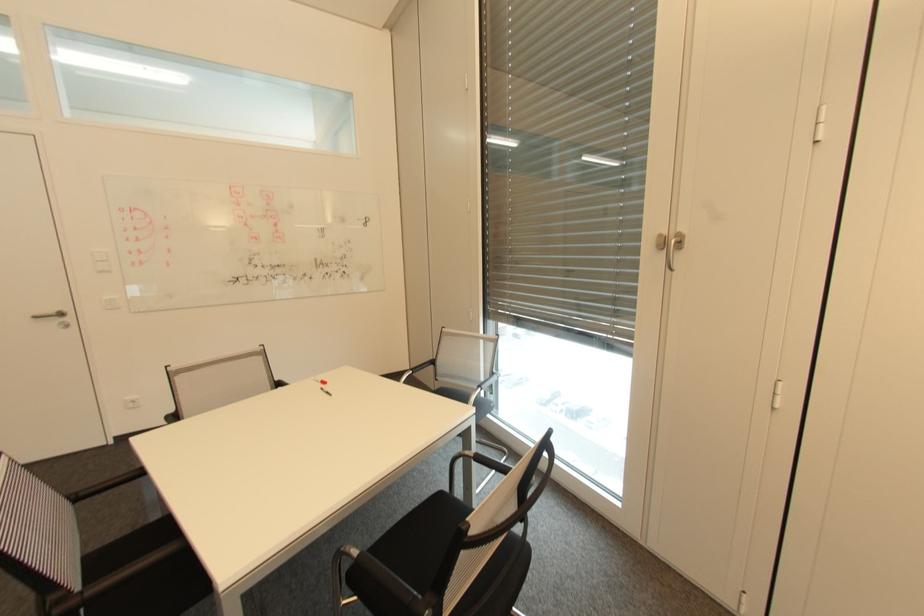
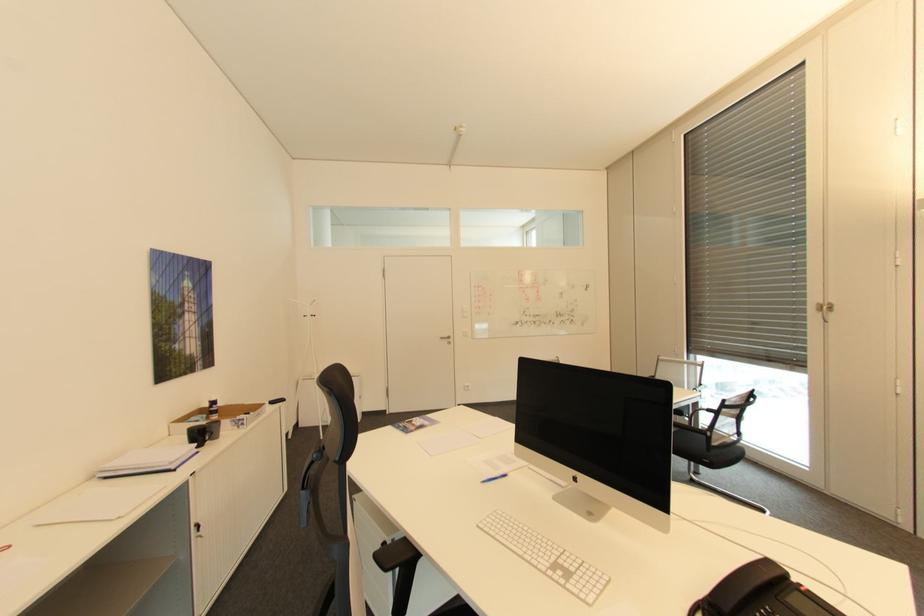
Which direction would the cameraman need to move to produce the second image?

The cameraman moved toward left, backward.